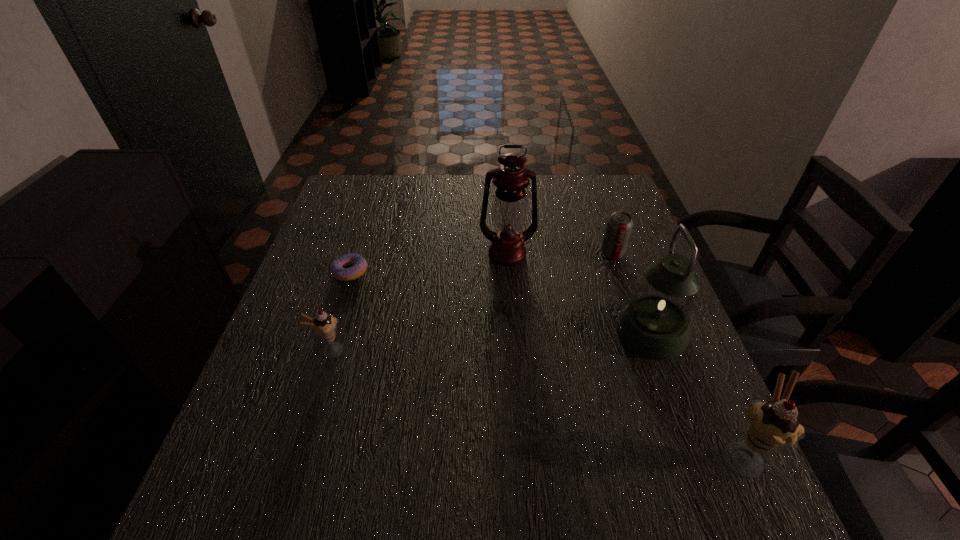
The height and width of the screenshot is (540, 960). Identify the location of the farther icecream. (324, 325).

Locate an element on the screen. This screenshot has width=960, height=540. the fourth tallest object is located at coordinates (324, 325).

Identify the location of the taller icecream. The image size is (960, 540). (772, 425).

In order to click on the right icecream in this screenshot , I will do `click(772, 425)`.

Locate an element on the screen. oil lamp is located at coordinates (509, 209).

The width and height of the screenshot is (960, 540). I want to click on the shortest object, so point(359,265).

The height and width of the screenshot is (540, 960). I want to click on soda can, so click(x=619, y=225).

The width and height of the screenshot is (960, 540). What are the coordinates of `lantern` in the screenshot? It's located at (655, 324).

Where is `vacant space located 0.140m on the back of the farther icecream`? This screenshot has height=540, width=960. vacant space located 0.140m on the back of the farther icecream is located at coordinates (348, 295).

Identify the location of free space located 0.370m on the left of the third tallest object. This screenshot has height=540, width=960. (508, 454).